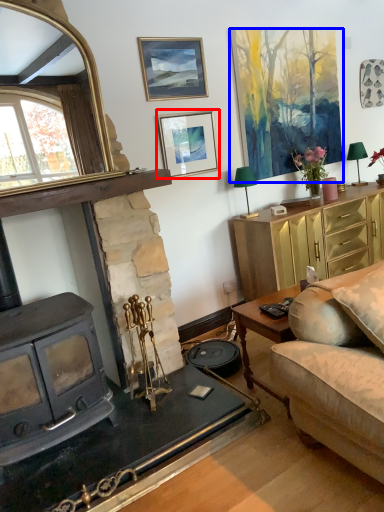
Question: Which object appears closest to the camera in this image, picture frame (highlighted by a red box) or picture frame (highlighted by a blue box)?

Choices:
 (A) picture frame
 (B) picture frame

Answer: (A)